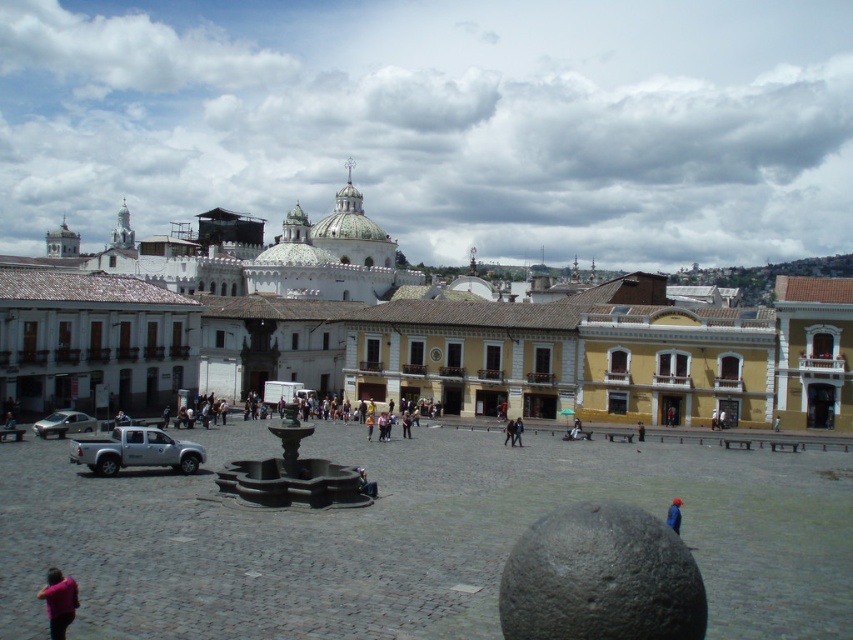
You are standing at the point marked by the coordinates point (409, 536) in the plaza. What object are you standing on?

The point (409, 536) marks the smooth concrete fountain at center, so you are standing on the smooth concrete fountain at center.

You are a tourist standing in the plaza and want to take a photo of both the smooth concrete fountain at center and the bronze fountain at center. Which one should you focus on first to ensure both are in the frame?

You should focus on the smooth concrete fountain at center first since it is closer to you than the bronze fountain at center, allowing both to be captured in the frame.